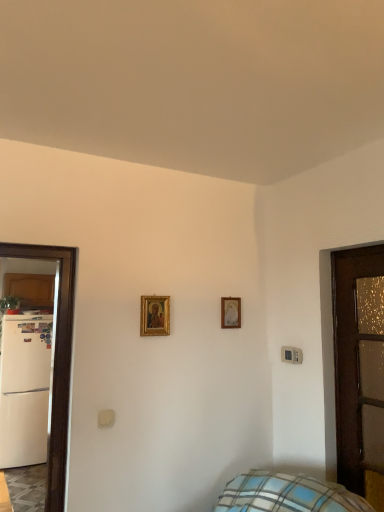
Question: Is brown wooden door at right taller or shorter than gold-framed picture at center, arranged as the second picture frame when viewed from the front?

Choices:
 (A) short
 (B) tall

Answer: (B)

Question: In the image, is brown wooden door at right positioned in front of or behind gold-framed picture at center, arranged as the 1th picture frame when viewed from the back?

Choices:
 (A) behind
 (B) front

Answer: (B)

Question: Which object is positioned farthest from the white matte refrigerator at left?

Choices:
 (A) gold-framed painting at center, marked as the 1th picture frame in a left-to-right arrangement
 (B) gold-framed picture at center, the 1th picture frame positioned from the right
 (C) brown wooden door at right

Answer: (C)

Question: Which object is positioned farthest from the brown wooden door at right?

Choices:
 (A) white matte refrigerator at left
 (B) gold-framed painting at center, which is the 1th picture frame in front-to-back order
 (C) gold-framed picture at center, arranged as the 1th picture frame when viewed from the back

Answer: (A)